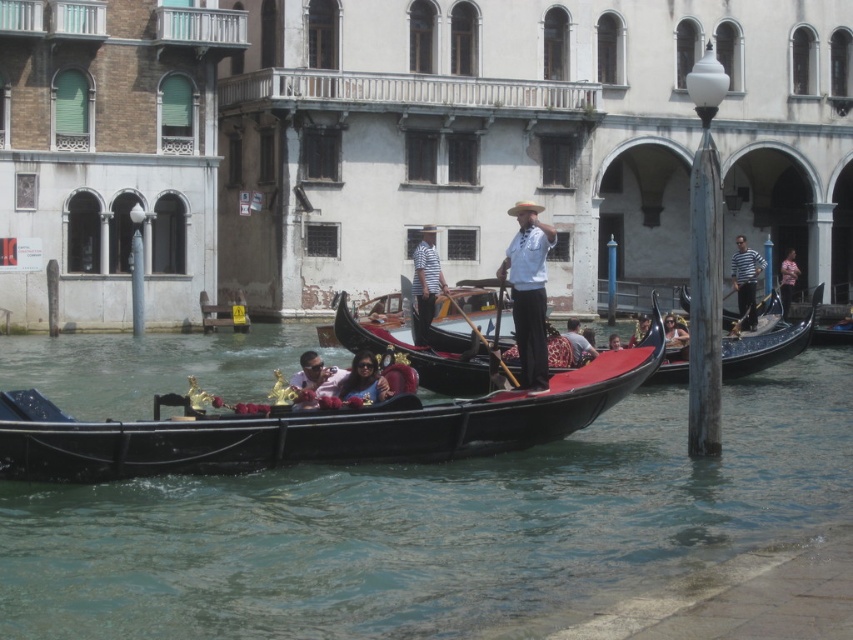
You are a tourist standing on the bridge overlooking the canal. You see two pink items in the water below. The first is a matte pink fabric at center and the second is a pink fabric shirt at center. Which of these pink items is farther away from the other?

The distance between the matte pink fabric at center and the pink fabric shirt at center is 25.73 meters, so the matte pink fabric at center is farther away from the pink fabric shirt at center by 25.73 meters.

In the scene shown: You are a tourist standing on the bridge above the canal. You see the black polished gondola at center and another gondola. How far apart are they?

The black polished gondola at center and the other gondola are 29.68 meters apart.

You are a tourist standing on the bridge overlooking the canal. You notice two items at the center of the scene. Which one is positioned to the right when looking at the white cotton shirt at center and the matte pink fabric at center?

The white cotton shirt at center is positioned to the right of the matte pink fabric at center.